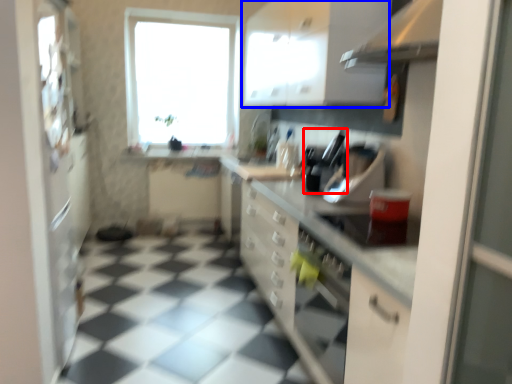
Question: Which object is further to the camera taking this photo, appliance (highlighted by a red box) or cabinetry (highlighted by a blue box)?

Choices:
 (A) appliance
 (B) cabinetry

Answer: (A)